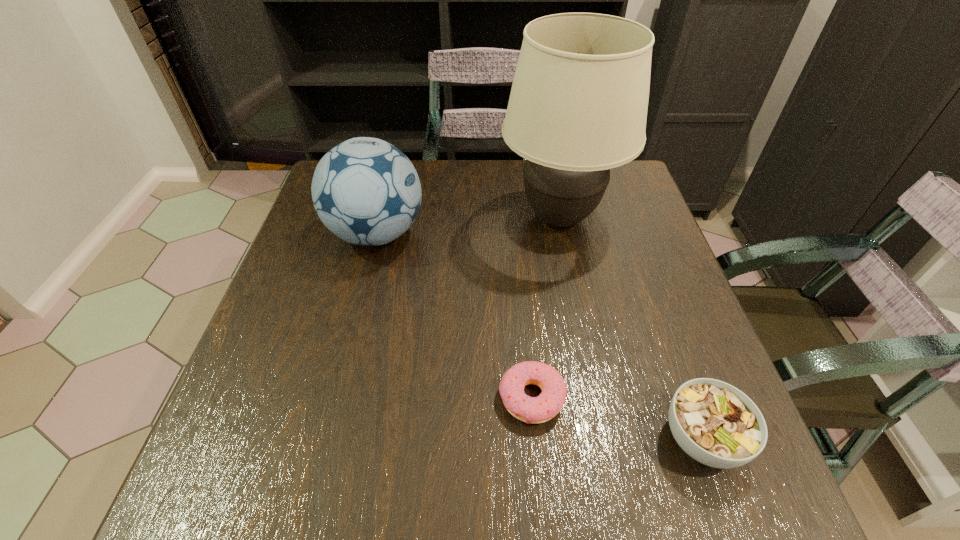
Find the location of a particular element. This screenshot has height=540, width=960. free space between the third shortest object and the second shortest object is located at coordinates (540, 336).

The image size is (960, 540). Find the location of `free space that is in between the soup bowl and the soccer ball`. free space that is in between the soup bowl and the soccer ball is located at coordinates (540, 336).

Locate an element on the screen. The height and width of the screenshot is (540, 960). free space between the second shortest object and the doughnut is located at coordinates (616, 418).

Find the location of a particular element. The image size is (960, 540). object that is the closest one to the soup bowl is located at coordinates (547, 405).

Locate an element on the screen. The image size is (960, 540). the third closest object relative to the leftmost object is located at coordinates (715, 423).

The image size is (960, 540). I want to click on free space that satisfies the following two spatial constraints: 1. on the side with brand of the leftmost object; 2. on the left side of the second shortest object, so click(325, 438).

Identify the location of vacant area in the image that satisfies the following two spatial constraints: 1. on the front side of the doughnut; 2. on the left side of the second shortest object. Image resolution: width=960 pixels, height=540 pixels. (536, 438).

I want to click on free space that satisfies the following two spatial constraints: 1. on the front side of the third tallest object; 2. on the left side of the lampshade, so click(603, 438).

Find the location of a particular element. The height and width of the screenshot is (540, 960). free space that satisfies the following two spatial constraints: 1. on the side with brand of the second shortest object; 2. on the left side of the leftmost object is located at coordinates (325, 438).